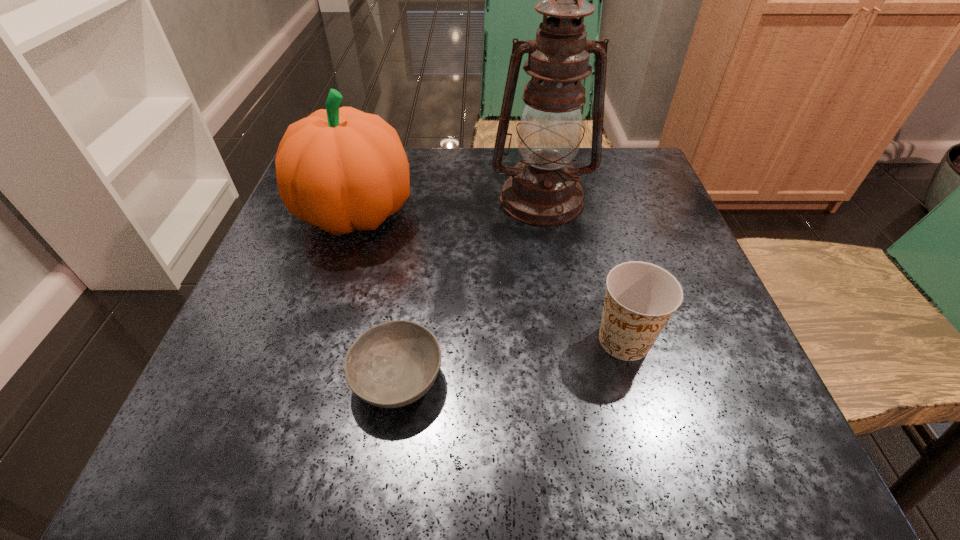
Locate an element on the screen. The width and height of the screenshot is (960, 540). oil lamp is located at coordinates (543, 190).

Find the location of a particular element. This screenshot has width=960, height=540. the third shortest object is located at coordinates (340, 169).

Locate an element on the screen. This screenshot has width=960, height=540. Dixie cup is located at coordinates (641, 297).

I want to click on the shortest object, so click(393, 364).

The width and height of the screenshot is (960, 540). In order to click on free space located on the front of the oil lamp in this screenshot , I will do `click(559, 305)`.

Find the location of `vacant region located on the right of the pumpkin`. vacant region located on the right of the pumpkin is located at coordinates coord(461,214).

Locate an element on the screen. The width and height of the screenshot is (960, 540). vacant region located on the left of the third tallest object is located at coordinates point(545,340).

Find the location of a particular element. free space located 0.110m on the left of the shortest object is located at coordinates 275,379.

At what (x,y) coordinates should I click in order to perform the action: click on oil lamp located in the far edge section of the desktop. Please return your answer as a coordinate pair (x, y). Looking at the image, I should click on (543, 190).

The width and height of the screenshot is (960, 540). Identify the location of pumpkin at the far edge. (340, 169).